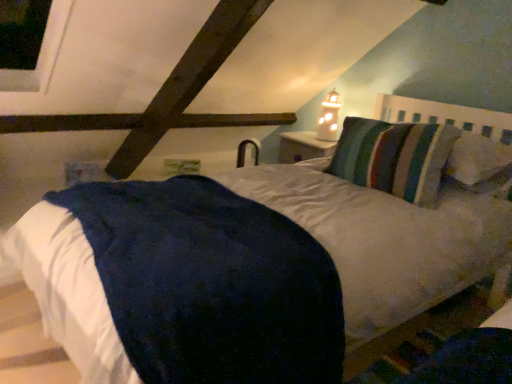
Question: Is striped fabric pillow at upper right in front of or behind white frosted glass at upper center in the image?

Choices:
 (A) front
 (B) behind

Answer: (A)

Question: Is point [x=378, y=140] closer or farther from the camera than point [x=327, y=127]?

Choices:
 (A) farther
 (B) closer

Answer: (B)

Question: Estimate the real-world distances between objects in this image. Which object is farther from the dark blue plush mattress at center?

Choices:
 (A) striped fabric pillow at upper right
 (B) velvety blue blanket at lower right
 (C) white frosted glass at upper center

Answer: (C)

Question: Which object is the closest to the dark blue plush mattress at center?

Choices:
 (A) velvety blue blanket at lower right
 (B) white frosted glass at upper center
 (C) striped fabric pillow at upper right

Answer: (A)